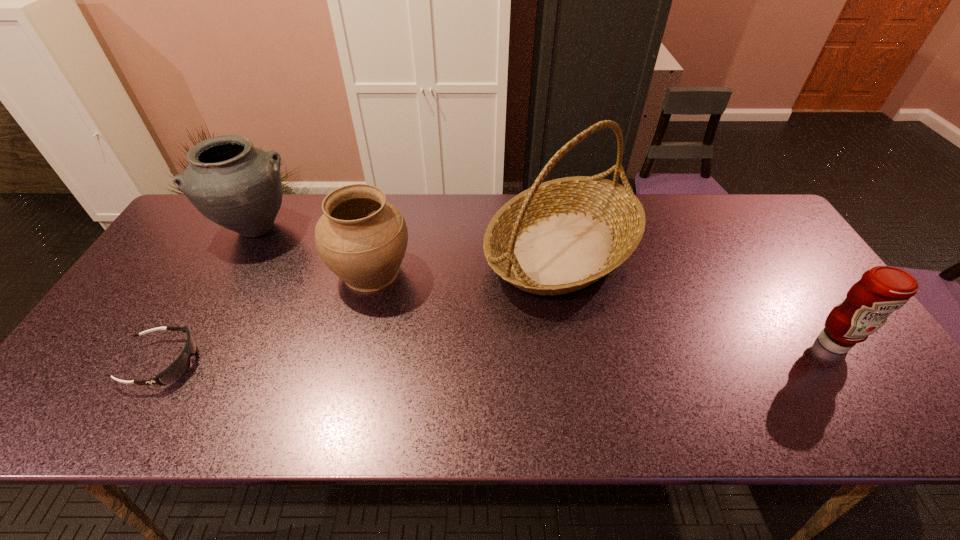
Where is `the tallest object`? The image size is (960, 540). the tallest object is located at coordinates (557, 237).

Find the location of a particular element. the fourth object from left to right is located at coordinates (557, 237).

Where is `the left urn`? the left urn is located at coordinates (237, 186).

Image resolution: width=960 pixels, height=540 pixels. What are the coordinates of `the third object from right to left` in the screenshot? It's located at (362, 238).

Find the location of a particular element. The height and width of the screenshot is (540, 960). condiment is located at coordinates (882, 290).

Image resolution: width=960 pixels, height=540 pixels. What are the coordinates of `goggles` in the screenshot? It's located at (179, 367).

In order to click on free spot located 0.240m on the right of the second object from right to left in this screenshot , I will do tap(723, 249).

I want to click on vacant space situated on the right of the left urn, so click(369, 227).

Where is `free spot located on the front of the third object from left to right`? free spot located on the front of the third object from left to right is located at coordinates (357, 331).

Image resolution: width=960 pixels, height=540 pixels. In order to click on free space located 0.220m on the back of the condiment in this screenshot , I will do `click(782, 267)`.